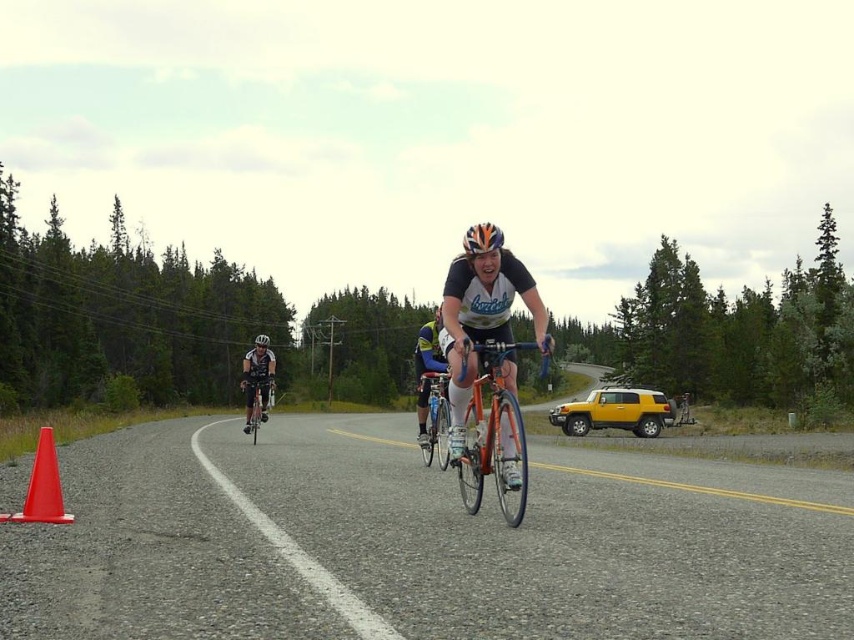
Question: Which point appears closest to the camera in this image?

Choices:
 (A) (264, 410)
 (B) (425, 356)
 (C) (496, 262)

Answer: (C)

Question: Does orange matte traffic cone at lower left appear under orange metallic bicycle at center?

Choices:
 (A) no
 (B) yes

Answer: (A)

Question: Which point is closer to the camera?

Choices:
 (A) (490, 360)
 (B) (260, 336)

Answer: (A)

Question: Does gravel road at lower left have a greater width compared to shiny orange bicycle at center?

Choices:
 (A) no
 (B) yes

Answer: (B)

Question: Which object is closer to the camera taking this photo?

Choices:
 (A) gravel road at lower left
 (B) shiny black helmet at center

Answer: (A)

Question: Can you confirm if shiny black helmet at center is wider than white matte bicycle helmet at center?

Choices:
 (A) no
 (B) yes

Answer: (B)